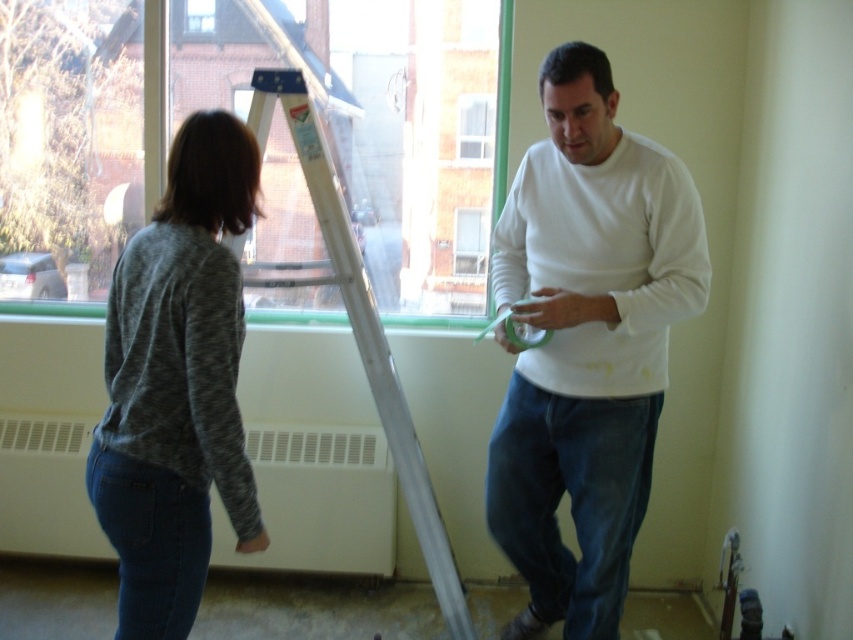
You are a painter who needs to reach a high spot on the wall. The white metallic ladder at center is your only tool. Can you safely use it if you are standing 6 feet away from the ladder?

The white metallic ladder at center is 7.26 feet from the camera, so if you are standing 6 feet away from the ladder, you would need to move closer to reach it safely. The distance between you and the ladder is insufficient for safe use.